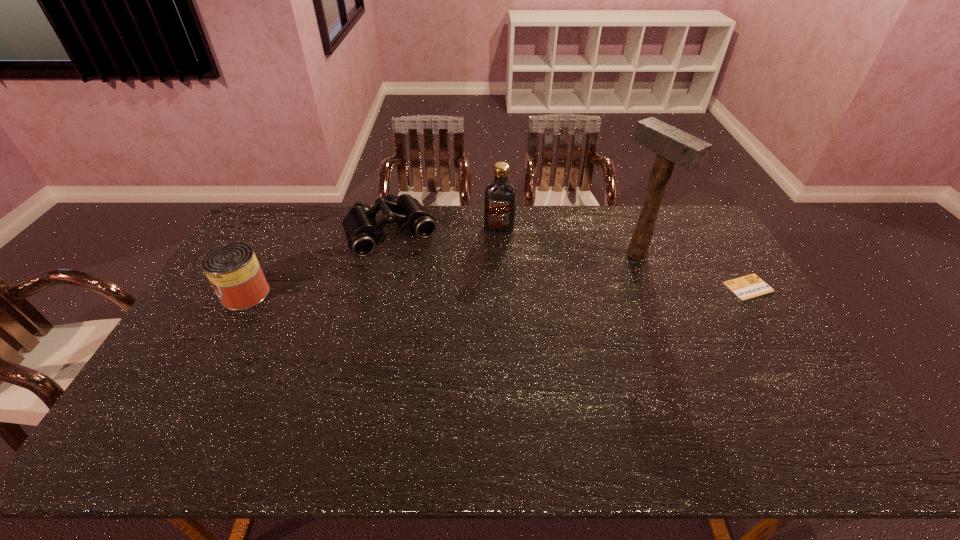
In order to click on vacant space at the far right corner of the desktop in this screenshot , I will do `click(666, 208)`.

Locate an element on the screen. free space between the second tallest object and the rightmost object is located at coordinates (624, 257).

What are the coordinates of `vacant area that lies between the rightmost object and the tallest object` in the screenshot? It's located at (692, 271).

Locate an element on the screen. The height and width of the screenshot is (540, 960). free space between the leftmost object and the second tallest object is located at coordinates (x=372, y=260).

Image resolution: width=960 pixels, height=540 pixels. What are the coordinates of `vacant space that is in between the third tallest object and the fourth object from right to left` in the screenshot? It's located at (319, 263).

Find the location of a particular element. This screenshot has width=960, height=540. unoccupied area between the third object from left to right and the identity card is located at coordinates (624, 257).

This screenshot has width=960, height=540. I want to click on vacant area that lies between the binoculars and the second tallest object, so click(x=445, y=230).

Locate an element on the screen. Image resolution: width=960 pixels, height=540 pixels. free area in between the second object from left to right and the shortest object is located at coordinates (570, 260).

Locate an element on the screen. The width and height of the screenshot is (960, 540). vacant space that's between the fourth object from left to right and the binoculars is located at coordinates (514, 243).

I want to click on free space that is in between the third shortest object and the mallet, so click(x=441, y=274).